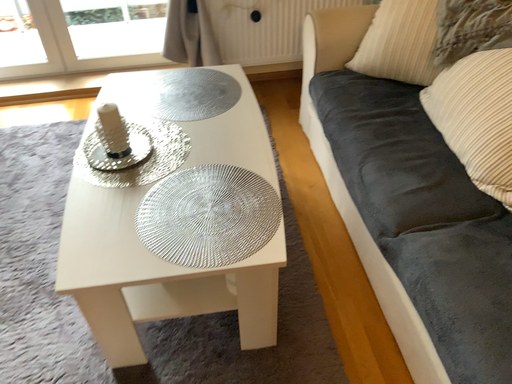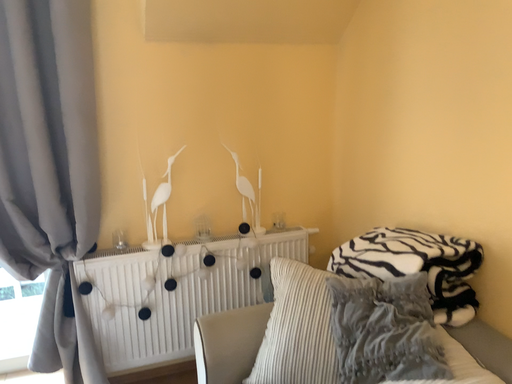
Question: Which way did the camera rotate in the video?

Choices:
 (A) rotated right
 (B) rotated left

Answer: (A)